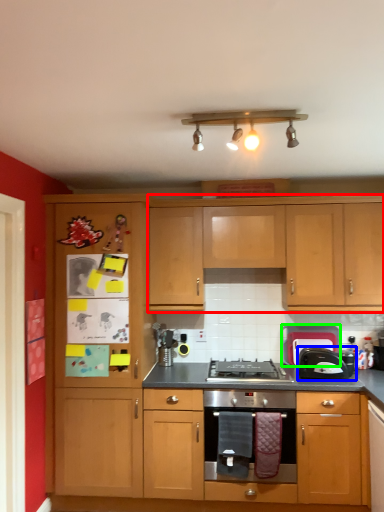
Question: Which object is positioned farthest from cabinetry (highlighted by a red box)? Select from toaster (highlighted by a blue box) and appliance (highlighted by a green box).

Choices:
 (A) toaster
 (B) appliance

Answer: (A)